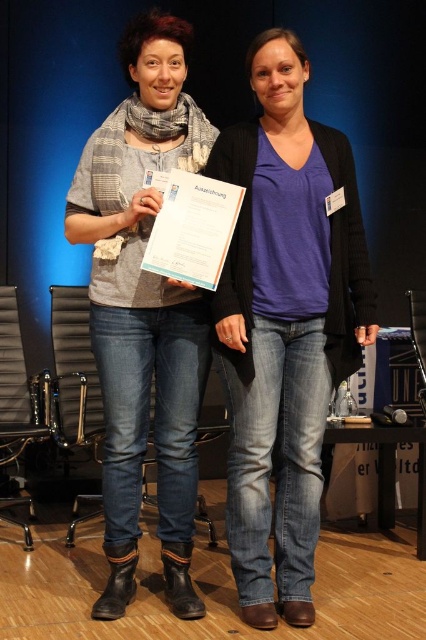
Question: Can you confirm if purple matte shirt at center is bigger than matte gray scarf at center?

Choices:
 (A) yes
 (B) no

Answer: (B)

Question: Which point is farther from the camera taking this photo?

Choices:
 (A) (98, 193)
 (B) (359, 344)

Answer: (B)

Question: Is purple matte shirt at center below matte gray scarf at center?

Choices:
 (A) yes
 (B) no

Answer: (A)

Question: Is purple matte shirt at center thinner than matte gray scarf at center?

Choices:
 (A) no
 (B) yes

Answer: (A)

Question: Which object is closer to the camera taking this photo?

Choices:
 (A) matte gray scarf at center
 (B) purple matte shirt at center

Answer: (B)